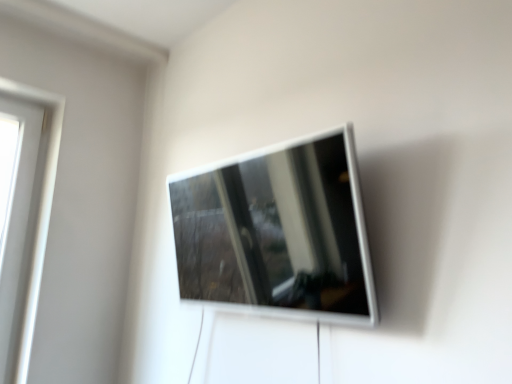
What do you see at coordinates (278, 233) in the screenshot? I see `silver metallic television at upper center` at bounding box center [278, 233].

Find the location of a particular element. silver metallic television at upper center is located at coordinates (278, 233).

I want to click on silver metallic television at upper center, so click(278, 233).